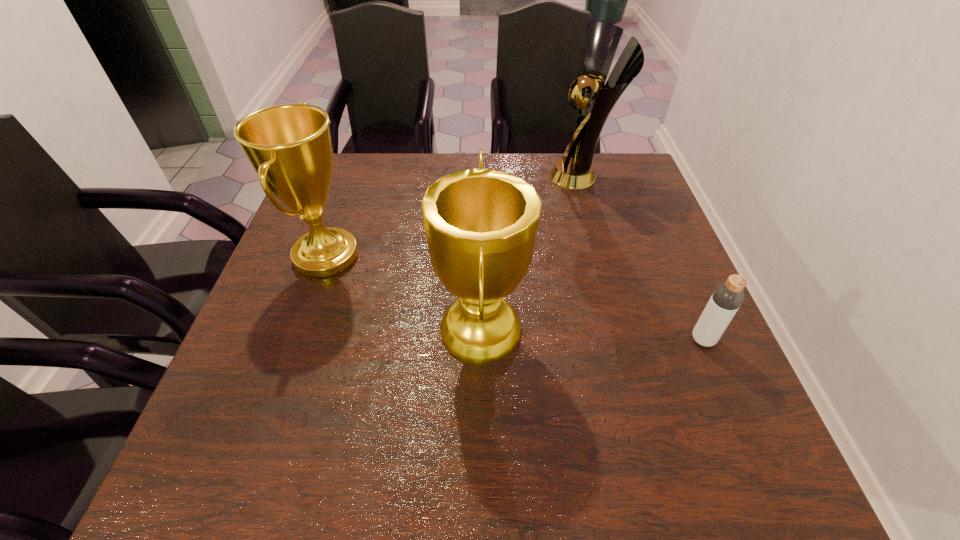
Locate an element on the screen. Image resolution: width=960 pixels, height=540 pixels. free spot that satisfies the following two spatial constraints: 1. by the handles of the shortest object; 2. on the right side of the leftmost award is located at coordinates (297, 340).

Identify the location of blank area in the image that satisfies the following two spatial constraints: 1. on the shiny surface of the rightmost object; 2. on the right side of the second award from right to left. click(x=481, y=340).

Where is `vacant space that satisfies the following two spatial constraints: 1. by the handles of the leftmost object; 2. on the left side of the rightmost object`? Image resolution: width=960 pixels, height=540 pixels. vacant space that satisfies the following two spatial constraints: 1. by the handles of the leftmost object; 2. on the left side of the rightmost object is located at coordinates (297, 340).

The width and height of the screenshot is (960, 540). What are the coordinates of `free space that satisfies the following two spatial constraints: 1. by the handles of the leftmost object; 2. on the left side of the shortest object` in the screenshot? It's located at (297, 340).

Where is `free location that satisfies the following two spatial constraints: 1. on the shiny surface of the second award from right to left; 2. on the left side of the rightmost object`? The width and height of the screenshot is (960, 540). free location that satisfies the following two spatial constraints: 1. on the shiny surface of the second award from right to left; 2. on the left side of the rightmost object is located at coordinates (481, 340).

This screenshot has width=960, height=540. What are the coordinates of `vacant position in the image that satisfies the following two spatial constraints: 1. by the handles of the leftmost object; 2. on the left side of the rightmost object` in the screenshot? It's located at (297, 340).